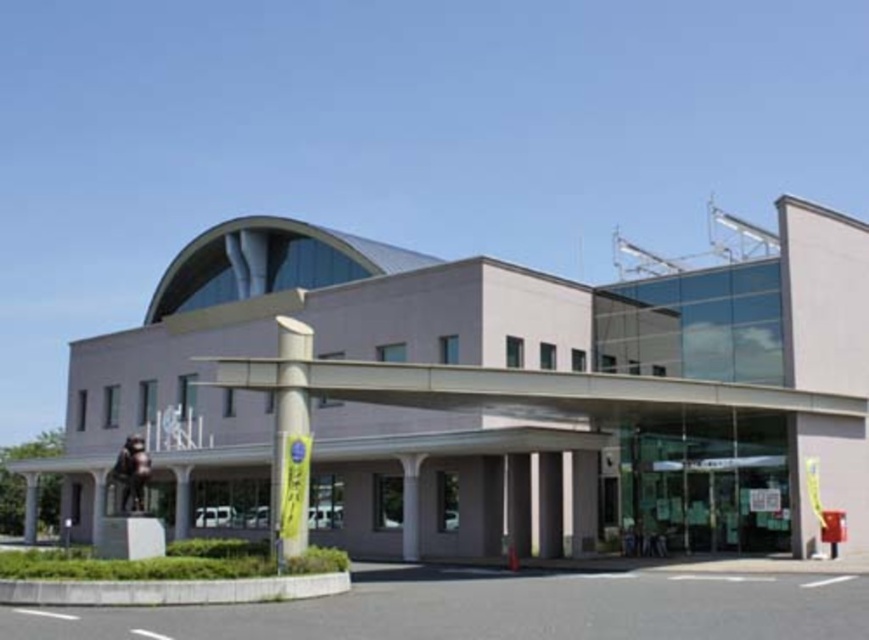
You are standing in front of the modern building and want to locate two specific points marked in the image. Which of the two points, point 1 at coordinates point [410,502] or point 2 at coordinates point [177,465], is closer to you?

Point 1 at coordinates point [410,502] is closer to you than point 2 at coordinates point [177,465] because the description states that point [410,502] is closer to the viewer than point [177,465].

You are standing at the entrance of the modern building and want to locate two specific points marked on a map. The first point is at coordinate point (180, 536), and the second is at point (28, 509). According to the image, which point is closer to you when facing the building?

Point (180, 536) is in front of point (28, 509), so when facing the building, point (180, 536) is closer to you.

You are an architect visiting the modern building and notice two pillars in front of the entrance. The white glossy pillar at center and the smooth concrete pillar at center. Which one is bigger in size?

The white glossy pillar at center has a larger size compared to the smooth concrete pillar at center.